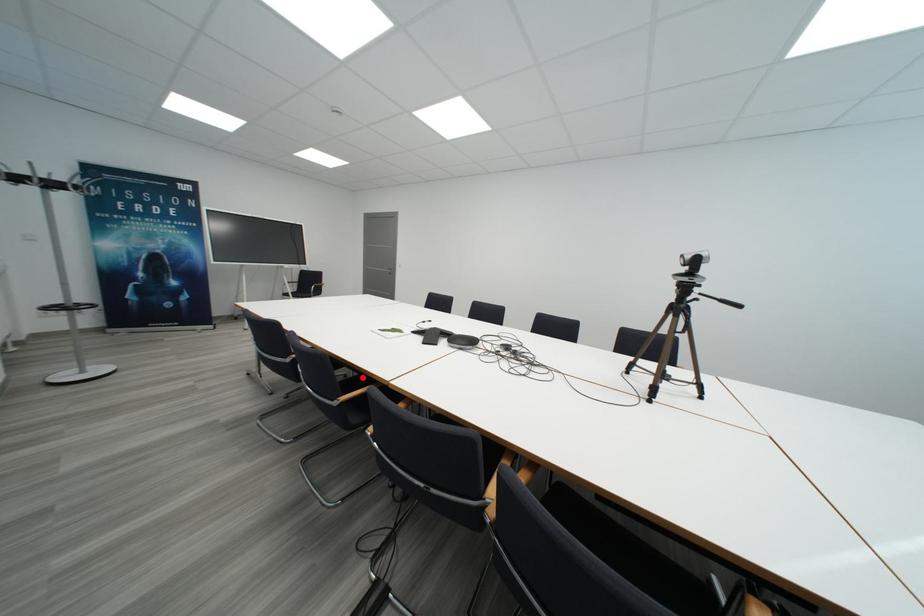
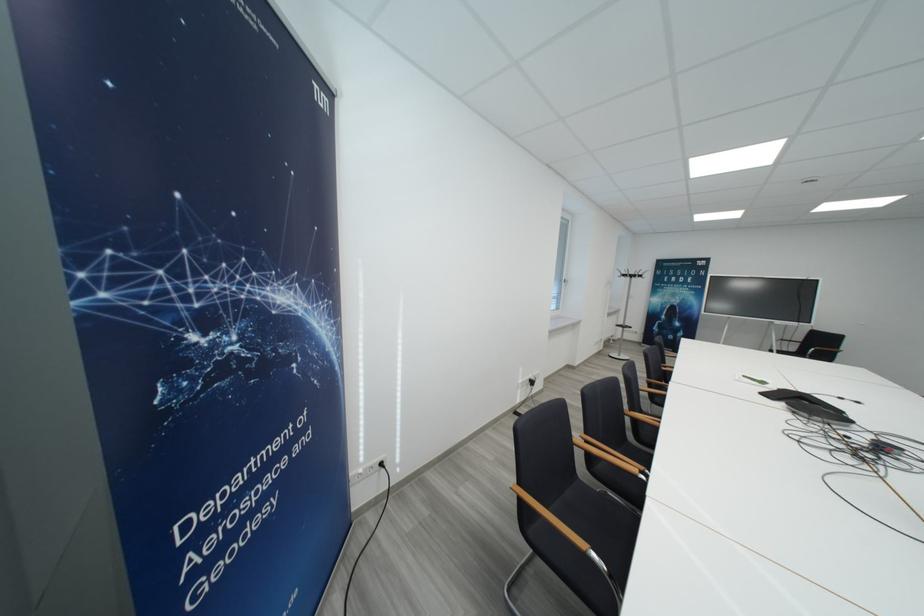
Question: I am providing you with two images of the same scene from different viewpoints. A red point is marked on the first image. At the location where the point appears in image 1, is it still visible in image 2?

Choices:
 (A) Yes
 (B) No

Answer: (B)